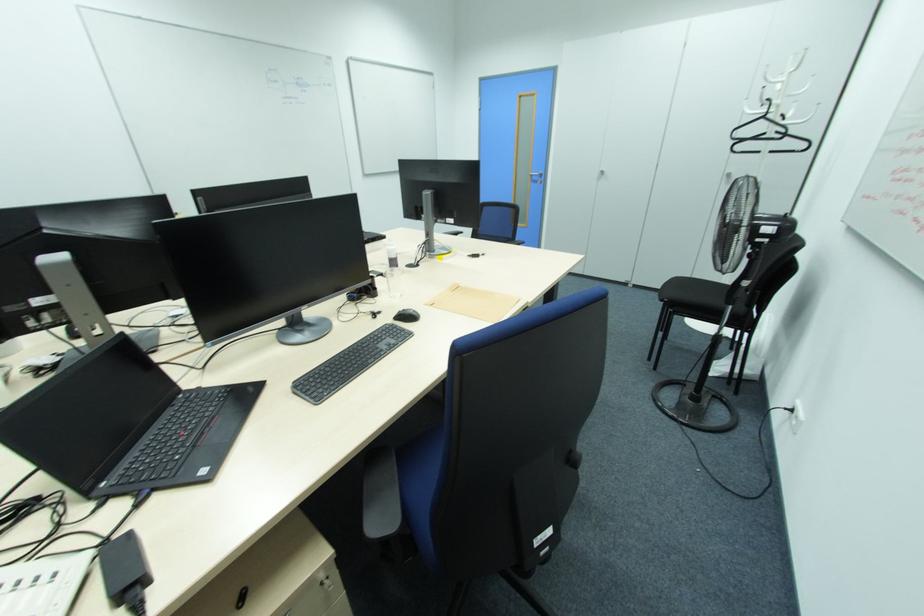
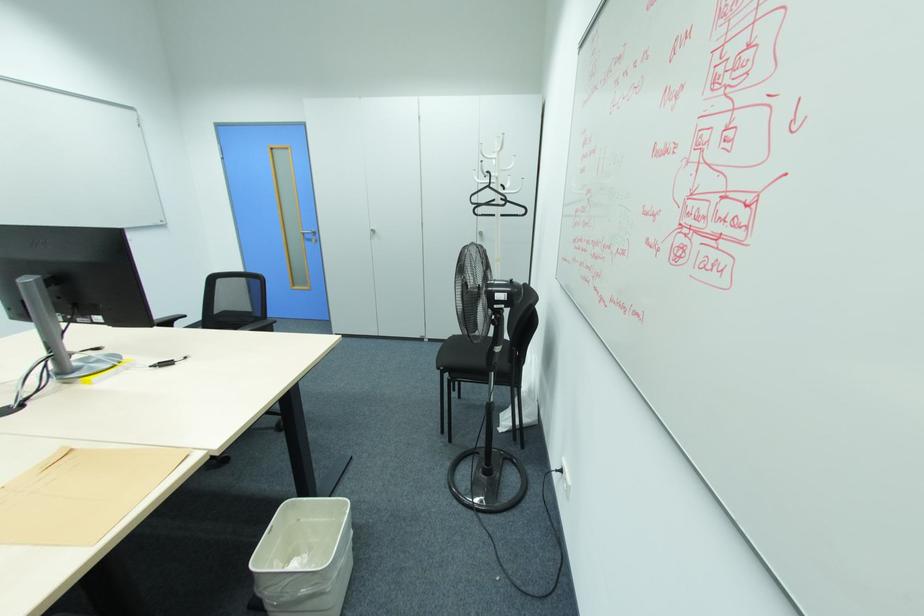
The point at (602,172) is marked in the first image. Where is the corresponding point in the second image?

(373, 231)